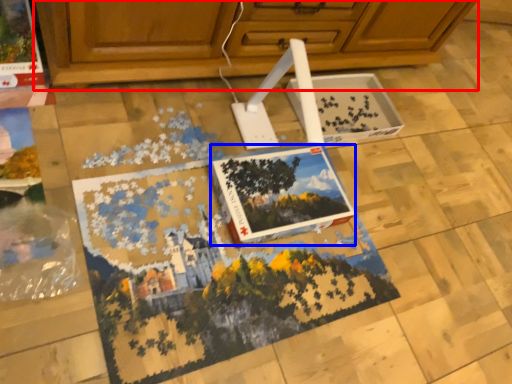
Question: Which point is closer to the camera, cabinetry (highlighted by a red box) or magazine (highlighted by a blue box)?

Choices:
 (A) cabinetry
 (B) magazine

Answer: (A)